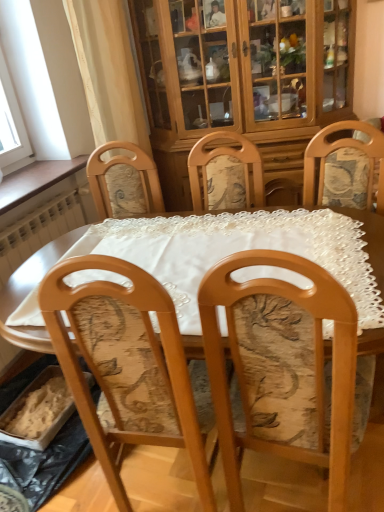
Where is `wooden chair with floral upholstery at center`? Image resolution: width=384 pixels, height=512 pixels. wooden chair with floral upholstery at center is located at coordinates (285, 369).

Locate an element on the screen. The width and height of the screenshot is (384, 512). wooden cabinet at upper center is located at coordinates (242, 76).

Are wooden cabinet at upper center and wooden table at center located far from each other?

Yes, wooden cabinet at upper center and wooden table at center are located far from each other.

From the image's perspective, which object appears higher, wooden cabinet at upper center or wooden table at center?

wooden cabinet at upper center is shown above in the image.

In the scene shown: Is wooden cabinet at upper center aimed at wooden table at center?

Yes, wooden cabinet at upper center is turned towards wooden table at center.

This screenshot has width=384, height=512. Identify the location of cabinetry above the wooden table at center (from a real-world perspective). (242, 76).

Is wooden table at center positioned with its back to wooden chair with floral upholstery at center?

wooden table at center does not have its back to wooden chair with floral upholstery at center.

From their relative heights in the image, would you say wooden table at center is taller or shorter than wooden chair with floral upholstery at center?

Clearly, wooden table at center is shorter compared to wooden chair with floral upholstery at center.

From the image's perspective, is wooden table at center on top of wooden chair with floral upholstery at center?

Yes, from the image's perspective, wooden table at center is on top of wooden chair with floral upholstery at center.

Between wooden table at center and wooden chair with floral upholstery at center, which one has smaller size?

Smaller between the two is wooden chair with floral upholstery at center.

Considering the positions of objects wooden cabinet at upper center and wooden chair with floral upholstery at center in the image provided, who is more to the left, wooden cabinet at upper center or wooden chair with floral upholstery at center?

From the viewer's perspective, wooden chair with floral upholstery at center appears more on the left side.

There is a wooden chair with floral upholstery at center. At what (x,y) coordinates should I click in order to perform the action: click on cabinetry above it (from a real-world perspective). Please return your answer as a coordinate pair (x, y). The image size is (384, 512). Looking at the image, I should click on (242, 76).

From a real-world perspective, is wooden cabinet at upper center on wooden chair with floral upholstery at center?

Correct, in the physical world, wooden cabinet at upper center is higher than wooden chair with floral upholstery at center.

Is wooden cabinet at upper center not within wooden chair with floral upholstery at center?

wooden cabinet at upper center is positioned outside wooden chair with floral upholstery at center.

Can you confirm if wooden table at center is bigger than wooden cabinet at upper center?

Actually, wooden table at center might be smaller than wooden cabinet at upper center.

Is point (363, 219) behind point (162, 98)?

No, it is not.

From the image's perspective, is wooden table at center below wooden cabinet at upper center?

Yes, from the image's perspective, wooden table at center is beneath wooden cabinet at upper center.

Does wooden chair with floral upholstery at center have a greater width compared to wooden cabinet at upper center?

No, wooden chair with floral upholstery at center is not wider than wooden cabinet at upper center.

From a real-world perspective, is wooden chair with floral upholstery at center below wooden cabinet at upper center?

Yes, from a real-world perspective, wooden chair with floral upholstery at center is under wooden cabinet at upper center.

Which object is positioned more to the left, wooden chair with floral upholstery at center or wooden cabinet at upper center?

Positioned to the left is wooden chair with floral upholstery at center.

Is wooden chair with floral upholstery at center positioned with its back to wooden cabinet at upper center?

No.

From the image's perspective, is wooden chair with floral upholstery at center located above or below wooden table at center?

Based on their image positions, wooden chair with floral upholstery at center is located beneath wooden table at center.

Is wooden chair with floral upholstery at center taller or shorter than wooden table at center?

Clearly, wooden chair with floral upholstery at center is taller compared to wooden table at center.

Can you confirm if wooden chair with floral upholstery at center is smaller than wooden table at center?

Indeed, wooden chair with floral upholstery at center has a smaller size compared to wooden table at center.

Is wooden chair with floral upholstery at center to the right of wooden table at center from the viewer's perspective?

Yes, wooden chair with floral upholstery at center is to the right of wooden table at center.

Where is `cabinetry above the wooden table at center (from the image's perspective)`? The height and width of the screenshot is (512, 384). cabinetry above the wooden table at center (from the image's perspective) is located at coordinates (242, 76).

The image size is (384, 512). Identify the location of chair located on the right of wooden table at center. (285, 369).

Estimate the real-world distances between objects in this image. Which object is closer to wooden cabinet at upper center, wooden chair with floral upholstery at center or wooden table at center?

wooden table at center.

Which object lies nearer to the anchor point wooden chair with floral upholstery at center, wooden cabinet at upper center or wooden table at center?

wooden table at center.

From the image, which object appears to be nearer to wooden cabinet at upper center, wooden table at center or wooden chair with floral upholstery at center?

wooden table at center is closer to wooden cabinet at upper center.

Based on their spatial positions, is wooden chair with floral upholstery at center or wooden cabinet at upper center further from wooden table at center?

Among the two, wooden cabinet at upper center is located further to wooden table at center.

In the scene shown: Considering their positions, is wooden table at center positioned further to wooden chair with floral upholstery at center than wooden cabinet at upper center?

The object further to wooden chair with floral upholstery at center is wooden cabinet at upper center.

Considering their positions, is wooden cabinet at upper center positioned closer to wooden table at center than wooden chair with floral upholstery at center?

The object closer to wooden table at center is wooden chair with floral upholstery at center.

The width and height of the screenshot is (384, 512). Identify the location of table between wooden cabinet at upper center and wooden chair with floral upholstery at center in the up-down direction. (26, 295).